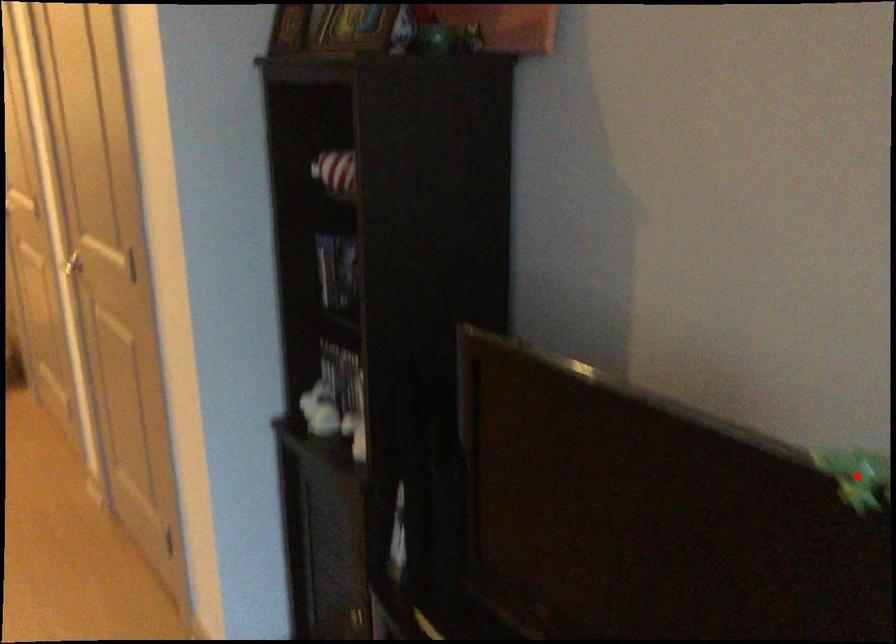
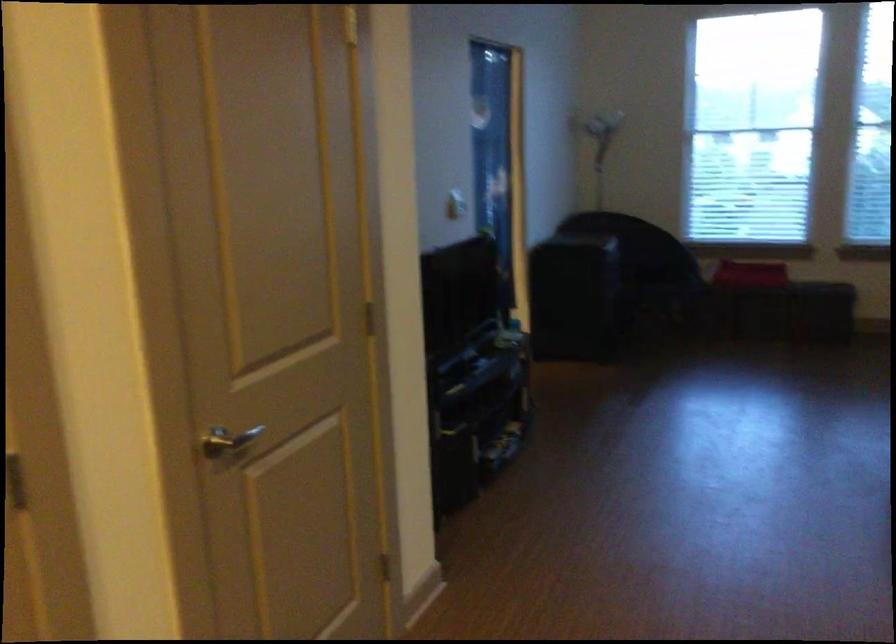
Question: I am providing you with two images of the same scene from different viewpoints. A red point is marked on the first image. At the location where the point appears in image 1, is it still visible in image 2?

Choices:
 (A) Yes
 (B) No

Answer: (B)